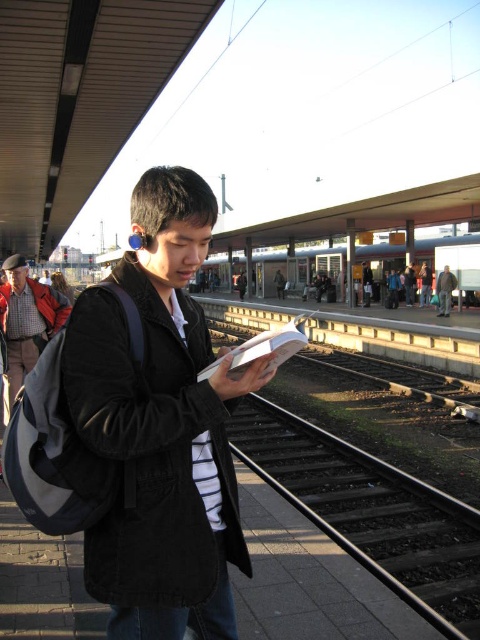
Looking at this image, is checkered wool sweater at left taller than dark gray jacket at center?

No.

This screenshot has width=480, height=640. What do you see at coordinates (26, 321) in the screenshot?
I see `checkered wool sweater at left` at bounding box center [26, 321].

Is point (36, 342) positioned behind point (442, 280)?

No, (36, 342) is in front of (442, 280).

You are a GUI agent. You are given a task and a screenshot of the screen. Output one action in this format:
    pyautogui.click(x=<x>, y=<y>)
    Task: Click on the checkered wool sweater at left
    Image resolution: width=480 pixels, height=640 pixels.
    Given the screenshot: What is the action you would take?
    pyautogui.click(x=26, y=321)

Which of these two, silver metallic train at center or checkered wool sweater at left, stands shorter?

checkered wool sweater at left

Which is in front, point (465, 275) or point (10, 356)?

Positioned in front is point (10, 356).

I want to click on silver metallic train at center, so click(299, 268).

Between black corduroy jacket at center and silver metallic train at center, which one is positioned lower?

Positioned lower is black corduroy jacket at center.

Between black corduroy jacket at center and silver metallic train at center, which one is positioned higher?

silver metallic train at center

Between point (120, 353) and point (404, 260), which one is positioned behind?

The point (404, 260) is more distant.

The width and height of the screenshot is (480, 640). I want to click on black corduroy jacket at center, so click(x=159, y=426).